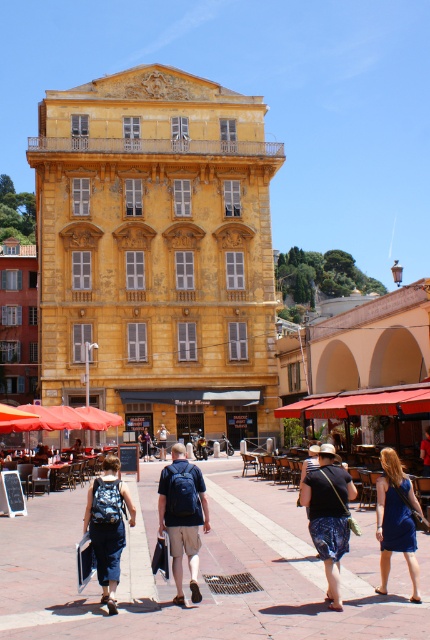
Question: Does brick paved square at center appear on the right side of blue satin dress at lower right?

Choices:
 (A) no
 (B) yes

Answer: (A)

Question: Is denim shorts at center thinner than denim pants at lower left?

Choices:
 (A) yes
 (B) no

Answer: (A)

Question: Considering the real-world distances, which object is farthest from the blue fabric backpack at center?

Choices:
 (A) brick paved square at center
 (B) denim pants at lower left
 (C) blue satin dress at lower right

Answer: (C)

Question: Which point appears closest to the camera in this image?

Choices:
 (A) (398, 500)
 (B) (322, 483)

Answer: (A)

Question: Which object is farther from the camera taking this photo?

Choices:
 (A) denim pants at lower left
 (B) denim shorts at center
 (C) blue fabric backpack at center
 (D) brick paved square at center

Answer: (C)

Question: Can you confirm if brick paved square at center is positioned to the left of blue satin dress at lower right?

Choices:
 (A) no
 (B) yes

Answer: (B)